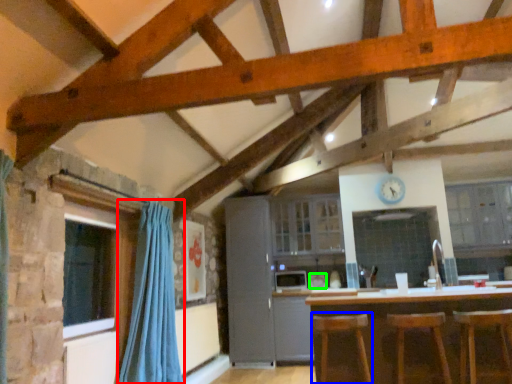
Question: Which object is the closest to the curtain (highlighted by a red box)? Choose among these: bar stool (highlighted by a blue box) or appliance (highlighted by a green box).

Choices:
 (A) bar stool
 (B) appliance

Answer: (A)